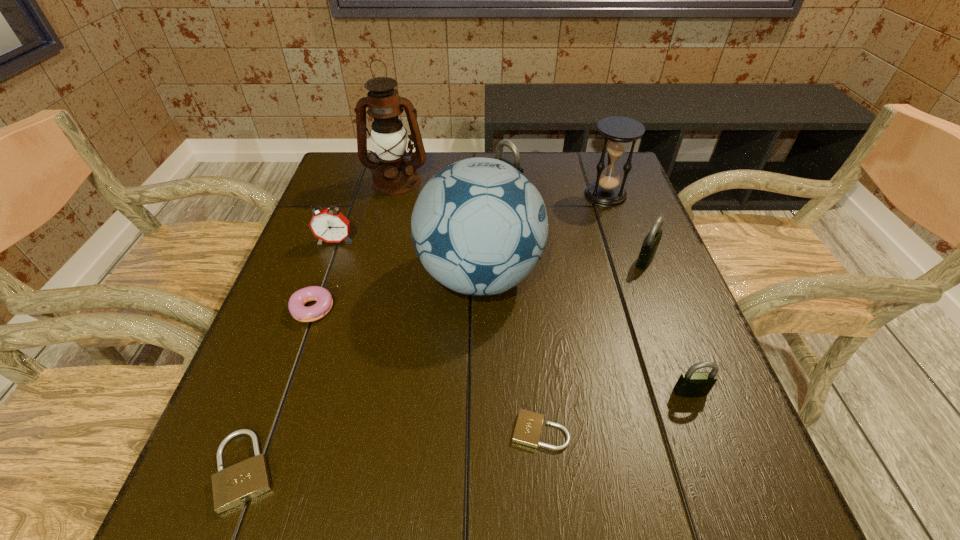
Locate an element on the screen. Image resolution: width=960 pixels, height=540 pixels. hourglass that is positioned at the far edge is located at coordinates (618, 132).

You are a GUI agent. You are given a task and a screenshot of the screen. Output one action in this format:
    pyautogui.click(x=<x>, y=<y>)
    Task: Click on the padlock present at the far edge
    The height and width of the screenshot is (540, 960).
    Given the screenshot: What is the action you would take?
    pyautogui.click(x=502, y=143)

This screenshot has width=960, height=540. I want to click on object positioned at the near edge, so click(x=239, y=483).

I want to click on lantern located at the left edge, so click(394, 175).

You are a GUI agent. You are given a task and a screenshot of the screen. Output one action in this format:
    pyautogui.click(x=<x>, y=<y>)
    Task: Click on the alarm clock that is at the left edge
    This screenshot has height=540, width=960.
    Given the screenshot: What is the action you would take?
    pyautogui.click(x=329, y=225)

Identify the location of doughnut located in the left edge section of the desktop. The height and width of the screenshot is (540, 960). (296, 303).

You are a GUI agent. You are given a task and a screenshot of the screen. Output one action in this format:
    pyautogui.click(x=<x>, y=<y>)
    Task: Click on the padlock that is at the left edge
    The width and height of the screenshot is (960, 540).
    Given the screenshot: What is the action you would take?
    pyautogui.click(x=239, y=483)

The width and height of the screenshot is (960, 540). In order to click on hourglass situated at the right edge in this screenshot , I will do `click(618, 132)`.

What are the coordinates of `object that is at the far left corner` in the screenshot? It's located at coord(394,175).

Where is `object at the near left corner`? This screenshot has width=960, height=540. object at the near left corner is located at coordinates click(239, 483).